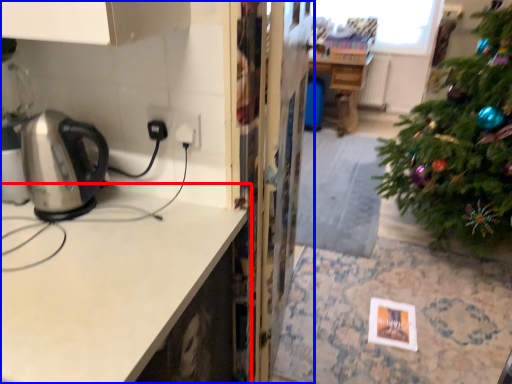
Question: Which object appears closest to the camera in this image, countertop (highlighted by a red box) or cabinetry (highlighted by a blue box)?

Choices:
 (A) countertop
 (B) cabinetry

Answer: (A)